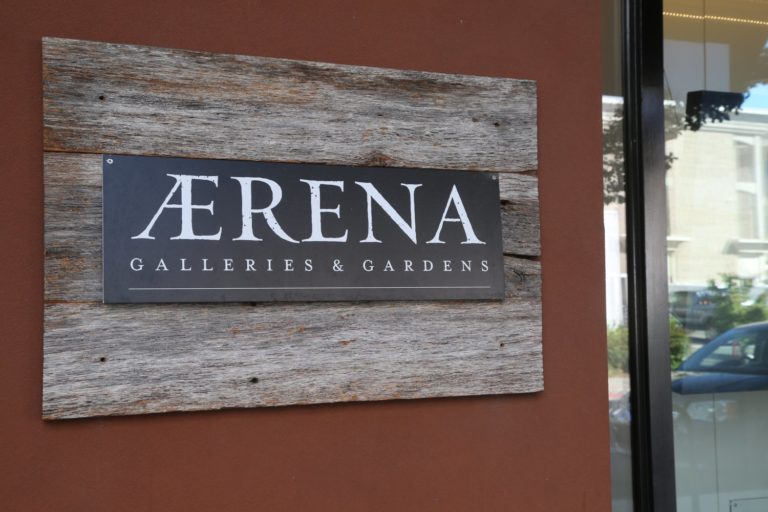
The height and width of the screenshot is (512, 768). In order to click on windows in this screenshot , I will do `click(746, 203)`, `click(672, 234)`.